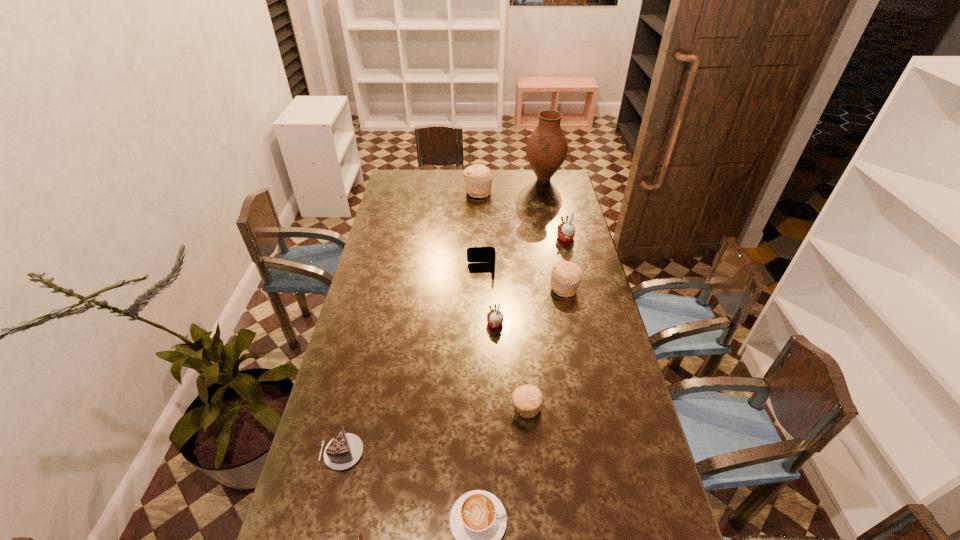
At what (x,y) coordinates should I click in order to perform the action: click on vase that is at the right edge. Please return your answer as a coordinate pair (x, y). Looking at the image, I should click on (546, 150).

Identify the location of object located at the far right corner. (546, 150).

The width and height of the screenshot is (960, 540). I want to click on free space at the far edge, so click(x=462, y=174).

Find the location of a particular element. vacant space at the left edge of the desktop is located at coordinates (368, 283).

At what (x,y) coordinates should I click in order to perform the action: click on free region at the right edge of the desktop. Please return your answer as a coordinate pair (x, y). The width and height of the screenshot is (960, 540). Looking at the image, I should click on (622, 395).

The width and height of the screenshot is (960, 540). I want to click on free region at the far left corner of the desktop, so click(x=416, y=175).

At what (x,y) coordinates should I click in order to perform the action: click on blank region between the farther pink muffin and the chocolate cake. Please return your answer as a coordinate pair (x, y). The height and width of the screenshot is (540, 960). Looking at the image, I should click on (454, 345).

Identify the location of vacant space that's between the second nearest beige muffin and the nearest muffin. (545, 348).

Find the location of `free space that is in between the third muffin from left to right and the tallest muffin`. free space that is in between the third muffin from left to right and the tallest muffin is located at coordinates (502, 300).

Find the location of a particular element. Image resolution: width=960 pixels, height=540 pixels. vacant region between the tallest object and the wallet is located at coordinates (513, 225).